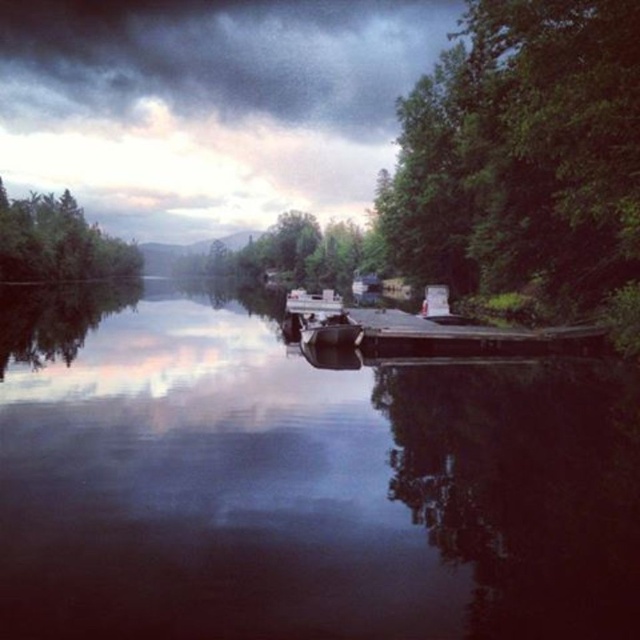
Question: Is green leafy tree at right bigger than metallic gray boat at center?

Choices:
 (A) no
 (B) yes

Answer: (B)

Question: Considering the real-world distances, which object is farthest from the green matte tree at left?

Choices:
 (A) smooth wood dock at center
 (B) smooth dark water at center
 (C) metallic gray boat at center
 (D) green leafy tree at right

Answer: (C)

Question: Does green matte tree at left have a lesser width compared to metallic silver boat at center?

Choices:
 (A) no
 (B) yes

Answer: (A)

Question: Among these objects, which one is nearest to the camera?

Choices:
 (A) smooth wood dock at center
 (B) green leafy tree at right

Answer: (B)

Question: Is green leafy tree at right thinner than metallic silver boat at center?

Choices:
 (A) yes
 (B) no

Answer: (B)

Question: Among these objects, which one is farthest from the camera?

Choices:
 (A) metallic gray boat at center
 (B) green matte tree at left

Answer: (B)